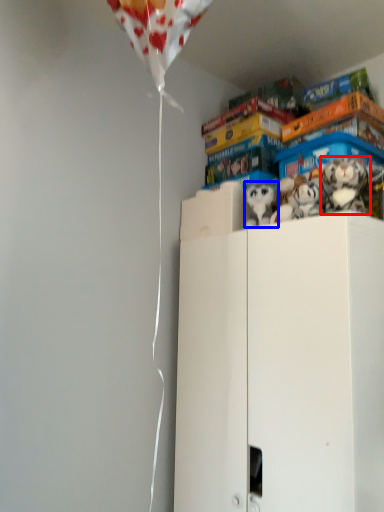
Question: Which object is closer to the camera taking this photo, toy (highlighted by a red box) or toy (highlighted by a blue box)?

Choices:
 (A) toy
 (B) toy

Answer: (A)